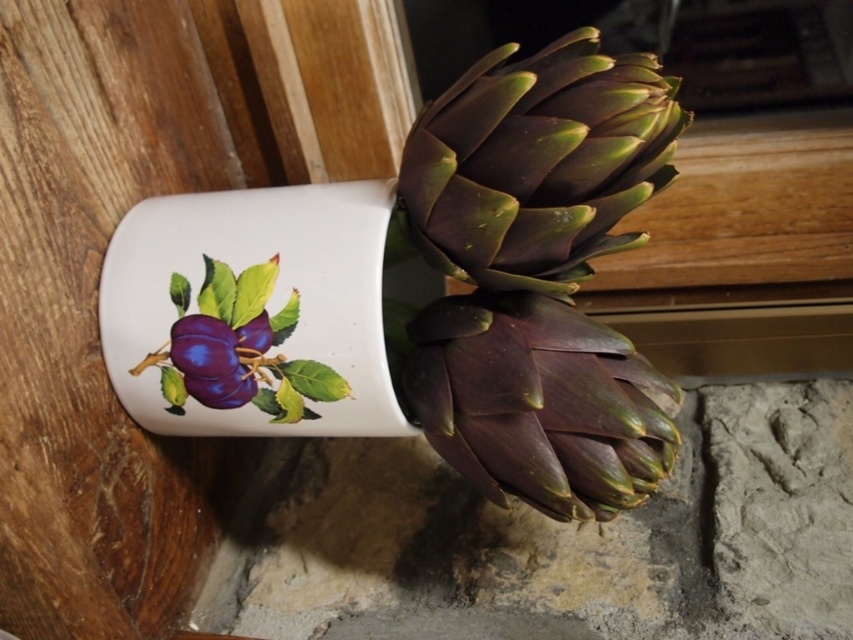
How far apart are dark green leafy artichoke at center and matte purple plum at center?

dark green leafy artichoke at center and matte purple plum at center are 16.09 inches apart from each other.

Between point (606, 86) and point (184, 378), which one is positioned in front?

Point (606, 86) is more forward.

The height and width of the screenshot is (640, 853). What do you see at coordinates (538, 163) in the screenshot?
I see `dark green leafy artichoke at center` at bounding box center [538, 163].

Locate an element on the screen. The width and height of the screenshot is (853, 640). dark green leafy artichoke at center is located at coordinates (538, 163).

Does dark purple leafy artichoke at center have a smaller size compared to matte purple plum at center?

No.

Can you confirm if dark purple leafy artichoke at center is positioned below matte purple plum at center?

Indeed, dark purple leafy artichoke at center is positioned under matte purple plum at center.

Where is `dark purple leafy artichoke at center`? This screenshot has height=640, width=853. dark purple leafy artichoke at center is located at coordinates (538, 403).

Is point (459, 211) behind point (503, 385)?

No, it is not.

Is dark green leafy artichoke at center smaller than dark purple leafy artichoke at center?

No.

Between point (463, 273) and point (469, 378), which one is positioned in front?

Point (469, 378) is more forward.

The image size is (853, 640). What are the coordinates of `dark green leafy artichoke at center` in the screenshot? It's located at (538, 163).